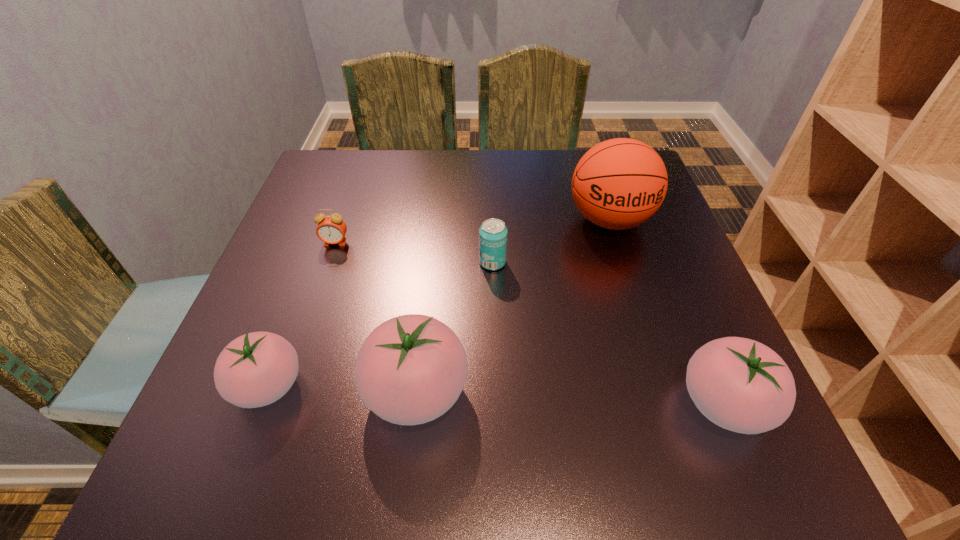
The image size is (960, 540). Identify the location of the leftmost tomato. (256, 369).

Identify the location of the fourth object from right to left. (411, 369).

Locate an element on the screen. The height and width of the screenshot is (540, 960). the fourth shortest object is located at coordinates (739, 384).

Find the location of a particular element. the rightmost tomato is located at coordinates (739, 384).

Locate an element on the screen. the fourth object from left to right is located at coordinates (493, 233).

The image size is (960, 540). I want to click on beer can, so click(x=493, y=233).

This screenshot has height=540, width=960. What are the coordinates of `basketball` in the screenshot? It's located at tap(618, 184).

I want to click on alarm clock, so click(x=331, y=229).

At what (x,y) coordinates should I click in order to perform the action: click on vacant region located 0.120m on the right of the leftmost tomato. Please return your answer as a coordinate pair (x, y). The height and width of the screenshot is (540, 960). Looking at the image, I should click on (375, 386).

Image resolution: width=960 pixels, height=540 pixels. Identify the location of vacant space located on the right of the second tomato from left to right. (498, 392).